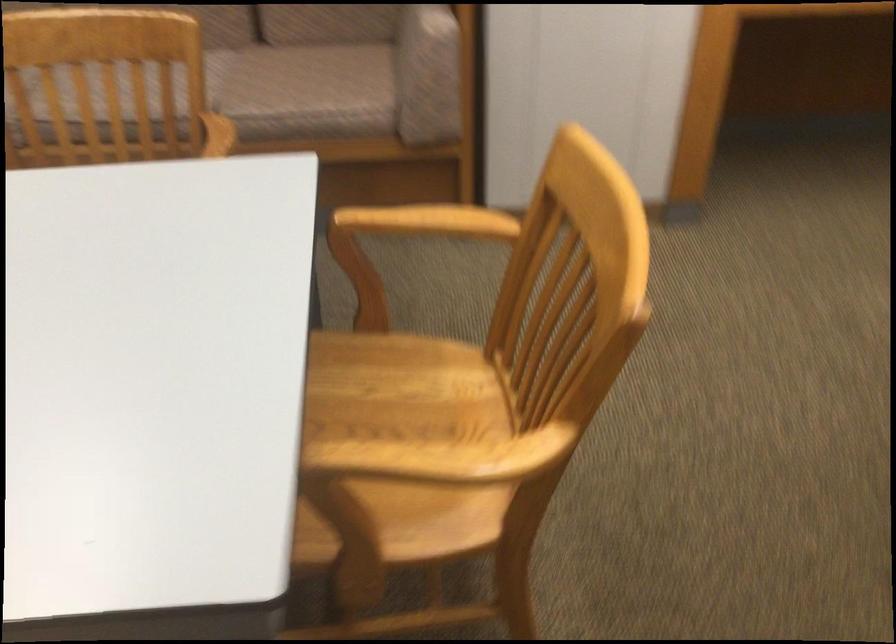
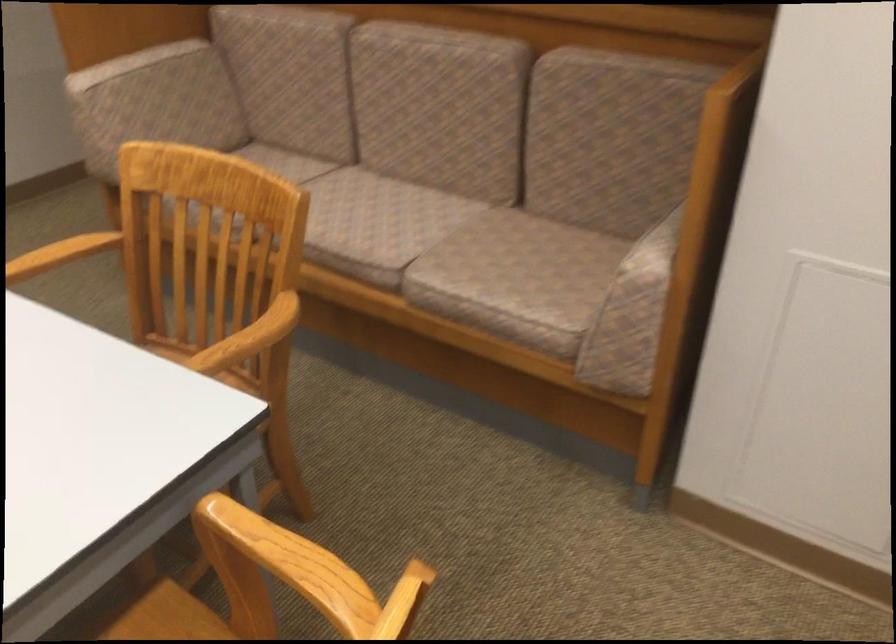
Find the pixel in the second image that matches point 216,144 in the first image.

(248, 339)